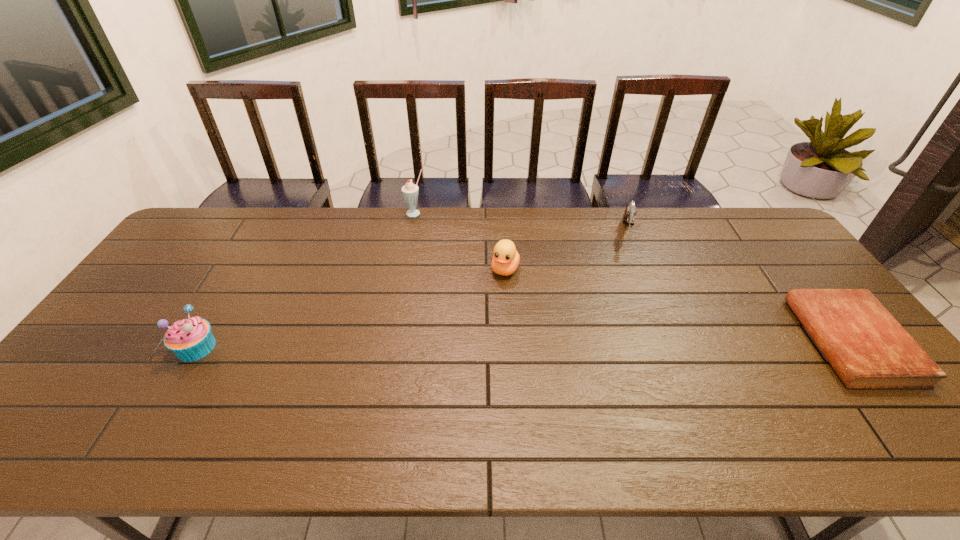
Find the location of a particular element. free space located 0.070m on the face of the third object from left to right is located at coordinates (495, 296).

This screenshot has height=540, width=960. Find the location of `milkshake at the far edge`. milkshake at the far edge is located at coordinates [x=410, y=191].

Image resolution: width=960 pixels, height=540 pixels. Find the location of `pistol located in the far edge section of the desktop`. pistol located in the far edge section of the desktop is located at coordinates (628, 217).

Image resolution: width=960 pixels, height=540 pixels. What are the coordinates of `object located at the near edge` in the screenshot? It's located at (867, 347).

Locate an element on the screen. The height and width of the screenshot is (540, 960). object that is at the right edge is located at coordinates (867, 347).

Identify the location of object present at the near right corner. (867, 347).

At what (x,y) coordinates should I click in order to perform the action: click on free space at the far edge of the desktop. Please return your answer as a coordinate pair (x, y). This screenshot has width=960, height=540. Looking at the image, I should click on (447, 221).

The image size is (960, 540). Identify the location of vacant space at the near edge of the desktop. (715, 382).

In the image, there is a desktop. Identify the location of free space at the left edge. Image resolution: width=960 pixels, height=540 pixels. (169, 266).

In the image, there is a desktop. Identify the location of free space at the right edge. (766, 260).